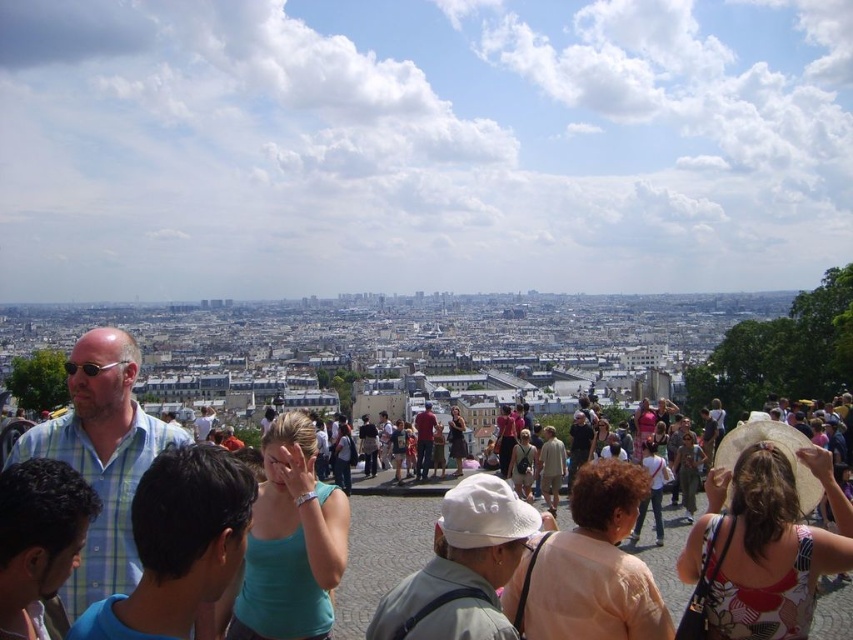
Question: Which point is farther to the camera?

Choices:
 (A) (219, 506)
 (B) (218, 600)

Answer: (B)

Question: Which object is positioned farthest from the beige cotton hat at center?

Choices:
 (A) teal fabric tank top at center
 (B) matte teal dress at center
 (C) matte blue tank top at center
 (D) light pink fabric at center

Answer: (A)

Question: Does printed fabric hat at center have a lesser width compared to matte beige hat at center?

Choices:
 (A) yes
 (B) no

Answer: (B)

Question: Is light pink cotton dress at center smaller than matte blue tank top at center?

Choices:
 (A) no
 (B) yes

Answer: (A)

Question: Is white fabric hat at center behind light pink cotton dress at center?

Choices:
 (A) yes
 (B) no

Answer: (B)

Question: Which object is farther from the camera taking this photo?

Choices:
 (A) teal fabric tank top at center
 (B) light pink fabric at center
 (C) green plaid shirt at left

Answer: (B)